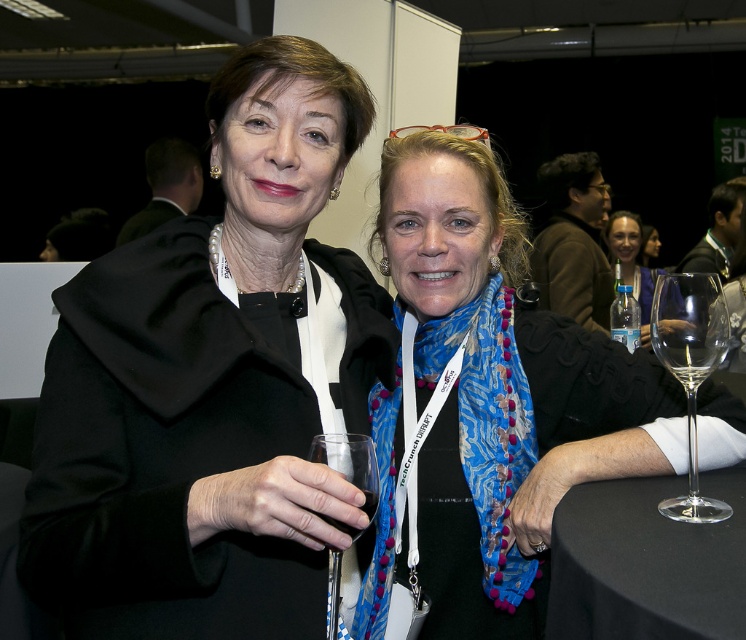
You are a bartender at this event and need to choose a wine glass for a guest who prefers a wider rim for their wine tasting. Which glass should you select between the transparent glass wine glass at right and the clear glass wine glass at center?

The transparent glass wine glass at right has a greater width than the clear glass wine glass at center, so it is the better choice for the guest who prefers a wider rim for wine tasting.

You are standing at the origin of the coordinate system in the image. There are two points marked in the image. Which point is closer to you, point (718, 340) or point (373, 448)?

Point (373, 448) is closer to you because it has a smaller y coordinate than point (718, 340). In a standard coordinate system, a smaller y value indicates a position closer to the viewer.

You are a photographer at a conference, and you want to take a photo of the two women seated at the table. You need to ensure that both the black fabric table at lower right and the translucent plastic water bottle at upper right are in the frame. Given their distance apart, do you think you can fit both into a single photo without moving the camera position?

The black fabric table at lower right is 10.27 feet from the translucent plastic water bottle at upper right. Since the distance between them is relatively large, it depends on the camera lens and framing. A wide angle lens might capture both, but a standard lens may require adjusting the zoom. However, given typical conference settings, it should be possible to include both in the frame without moving the camera.